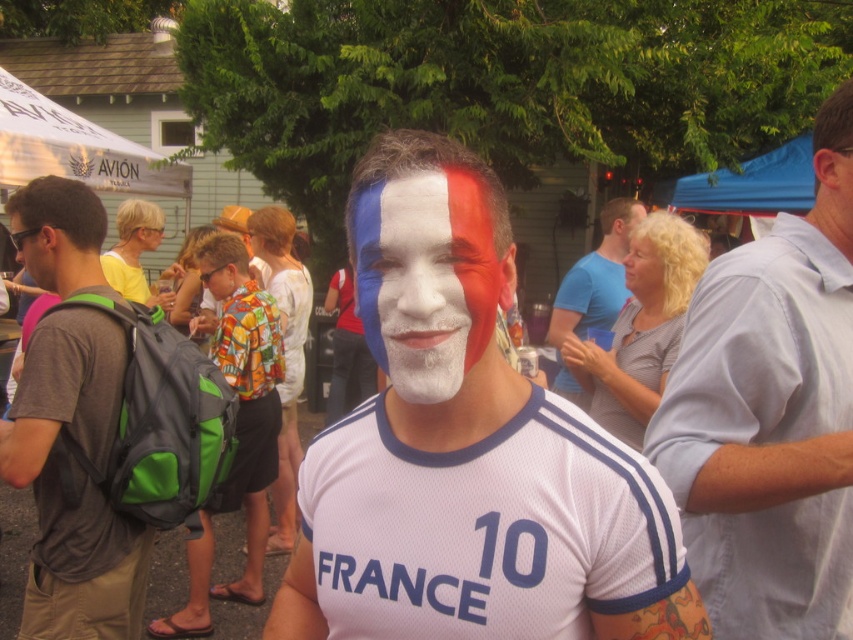
You are a photographer at the event and need to capture a clear photo of the man. The matte white face paint at center and the light blue shirt at center are both important elements. Which element should you focus on first to ensure it is in the foreground?

The matte white face paint at center has a lesser height compared to the light blue shirt at center, so you should focus on the light blue shirt at center first since it is positioned higher and would naturally be in the foreground.